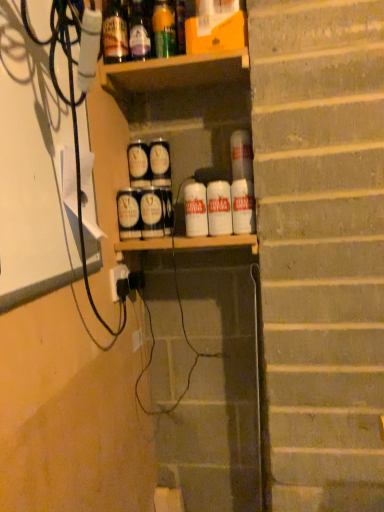
Question: Choose the correct answer: Is black plastic cable at left inside white matte can at center, the 3th beverage from the right, or outside it?

Choices:
 (A) outside
 (B) inside

Answer: (A)

Question: Considering the positions of black plastic cable at left and white matte can at center, positioned as the 3th beverage in left-to-right order, in the image, is black plastic cable at left wider or thinner than white matte can at center, positioned as the 3th beverage in left-to-right order,?

Choices:
 (A) thin
 (B) wide

Answer: (A)

Question: Which object is the farthest from the white matte can at center, the 3th beverage from the right?

Choices:
 (A) matte black cans at center, positioned as the third spray in front-to-back order
 (B) white matte can at center, the fourth beverage in the right-to-left sequence
 (C) white plastic electric outlet at lower center
 (D) white matte can at right, the 5th beverage positioned from the left
 (E) translucent glass bottle at upper center, which appears as the 1th bottle when viewed from the left

Answer: (E)

Question: Considering the real-world distances, which object is closest to the translucent glass bottle at upper center, the 2th bottle viewed from the left?

Choices:
 (A) matte black cans at center, which is counted as the 2th spray, starting from the front
 (B) matte silver spray can at center, arranged as the 1th spray when viewed from the front
 (C) matte black cans at center, which ranks as the 1th spray in back-to-front order
 (D) matte black can at center, which appears as the fifth beverage when viewed from the right
 (E) white matte can at center, the 3th beverage from the right

Answer: (D)